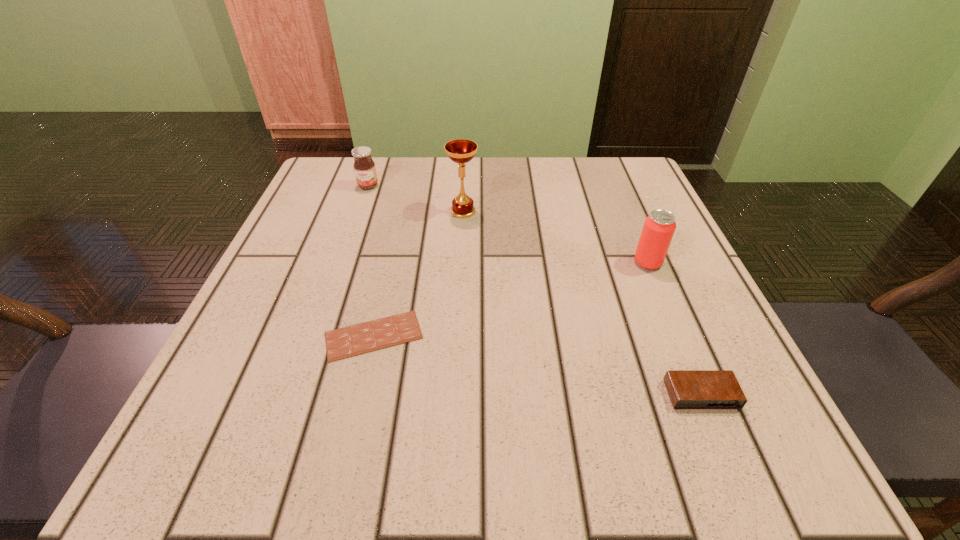
Where is `free spot between the beer can and the third tallest object`? The image size is (960, 540). free spot between the beer can and the third tallest object is located at coordinates (508, 225).

I want to click on vacant space in between the second shortest object and the chocolate bar, so click(538, 365).

Locate an element on the screen. empty location between the second nearest object and the jam is located at coordinates (371, 261).

Identify the location of free space between the chalice and the alarm clock. This screenshot has height=540, width=960. (582, 303).

Locate an element on the screen. free spot between the nearest object and the chalice is located at coordinates (582, 303).

The image size is (960, 540). What are the coordinates of `free area in between the third nearest object and the third shortest object` in the screenshot? It's located at (508, 225).

Locate an element on the screen. The image size is (960, 540). empty space between the alarm clock and the fourth farthest object is located at coordinates (538, 365).

Identify the location of free point between the alarm clock and the beer can. The image size is (960, 540). (674, 329).

Select which object is the second closest to the farthest object. Please provide its 2D coordinates. Your answer should be formatted as a tuple, i.e. [(x, y)], where the tuple contains the x and y coordinates of a point satisfying the conditions above.

[(366, 337)]

At what (x,y) coordinates should I click in order to perform the action: click on object that ranks as the closest to the alarm clock. Please return your answer as a coordinate pair (x, y). Looking at the image, I should click on (659, 227).